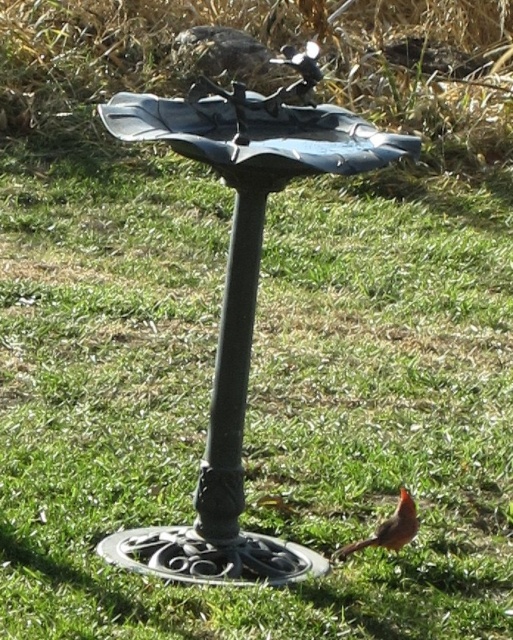
You are a photographer trying to capture the matte orange bird at lower right and the black metal pole at center in the same frame. Which object should you focus on first to ensure both are in focus?

You should focus on the black metal pole at center first because it is closer to the viewer than the matte orange bird at lower right, so adjusting focus from near to far will help both objects be in focus.

You are a bird watcher observing the garden scene. You notice the black metal pole at center and the matte orange bird at lower right. Which object is located higher in the image?

The black metal pole at center is positioned over the matte orange bird at lower right, so it is higher in the image.

You are a bird watcher trying to observe the matte orange bird at lower right. The black metal pole at center is blocking your view. Can you estimate whether the pole is taller than the bird?

The black metal pole at center has a greater height compared to the matte orange bird at lower right, so yes, the pole is taller than the bird.